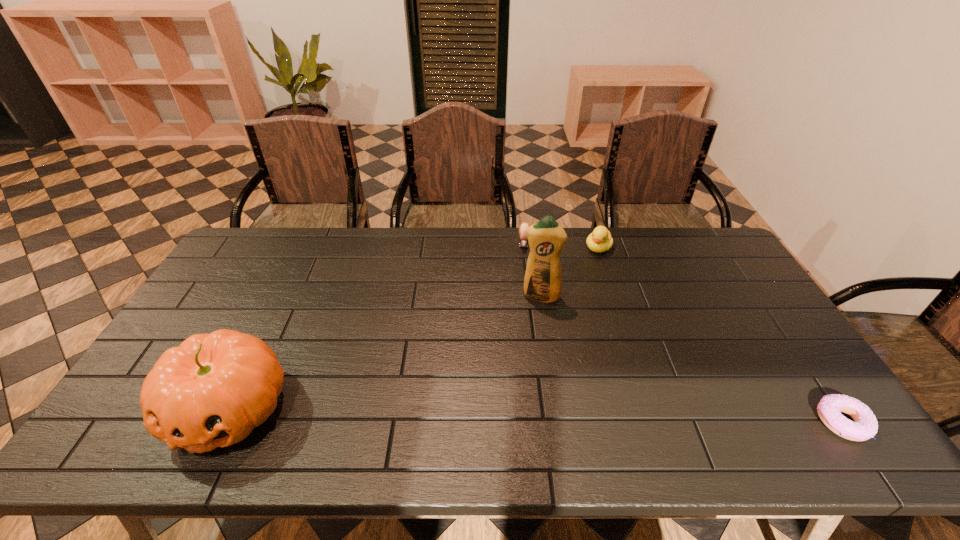
At what (x,y) coordinates should I click in order to perform the action: click on pumpkin. Please return your answer as a coordinate pair (x, y). Looking at the image, I should click on (211, 391).

Identify the location of the leftmost object. (211, 391).

Where is `the rightmost object`? the rightmost object is located at coordinates (865, 426).

Identify the location of the shortest object. The image size is (960, 540). (865, 426).

I want to click on the third farthest object, so click(543, 278).

The width and height of the screenshot is (960, 540). I want to click on the tallest object, so click(543, 278).

Find the location of `duckling`. duckling is located at coordinates (600, 240).

This screenshot has width=960, height=540. What are the coordinates of `the third tallest object` in the screenshot? It's located at (600, 240).

Where is `the second shortest object`? the second shortest object is located at coordinates (523, 242).

The width and height of the screenshot is (960, 540). I want to click on vacant area situated 0.360m on the back of the shortest object, so click(759, 300).